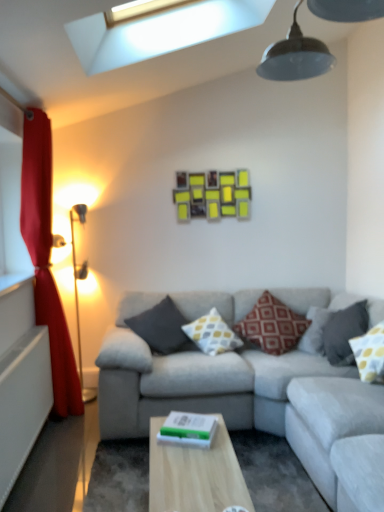
Question: From a real-world perspective, is dark gray fabric pillow at center, which is counted as the 5th pillow, starting from the right, under light wood table at center?

Choices:
 (A) no
 (B) yes

Answer: (A)

Question: Does dark gray fabric pillow at center, which is counted as the 5th pillow, starting from the right, turn towards light wood table at center?

Choices:
 (A) no
 (B) yes

Answer: (B)

Question: Is dark gray fabric pillow at center, which is counted as the 5th pillow, starting from the right, in front of light wood table at center?

Choices:
 (A) yes
 (B) no

Answer: (B)

Question: Considering the relative sizes of dark gray fabric pillow at center, which is counted as the 5th pillow, starting from the right, and light wood table at center in the image provided, is dark gray fabric pillow at center, which is counted as the 5th pillow, starting from the right, bigger than light wood table at center?

Choices:
 (A) no
 (B) yes

Answer: (A)

Question: Is dark gray fabric pillow at center, which is counted as the 5th pillow, starting from the right, shorter than light wood table at center?

Choices:
 (A) no
 (B) yes

Answer: (A)

Question: Considering the relative positions of dark gray fabric pillow at center, marked as the 1th pillow in a left-to-right arrangement, and light wood table at center in the image provided, is dark gray fabric pillow at center, marked as the 1th pillow in a left-to-right arrangement, to the right of light wood table at center from the viewer's perspective?

Choices:
 (A) no
 (B) yes

Answer: (A)

Question: From the image's perspective, does light wood table at center appear higher than yellow dotted fabric pillow at right, marked as the fifth pillow in a left-to-right arrangement?

Choices:
 (A) no
 (B) yes

Answer: (A)

Question: Does light wood table at center have a smaller size compared to yellow dotted fabric pillow at right, the first pillow in the right-to-left sequence?

Choices:
 (A) yes
 (B) no

Answer: (B)

Question: From a real-world perspective, does light wood table at center sit lower than yellow dotted fabric pillow at right, marked as the fifth pillow in a left-to-right arrangement?

Choices:
 (A) no
 (B) yes

Answer: (B)

Question: Considering the relative sizes of light wood table at center and yellow dotted fabric pillow at right, marked as the fifth pillow in a left-to-right arrangement, in the image provided, is light wood table at center wider than yellow dotted fabric pillow at right, marked as the fifth pillow in a left-to-right arrangement,?

Choices:
 (A) yes
 (B) no

Answer: (A)

Question: Can you confirm if light wood table at center is thinner than yellow dotted fabric pillow at right, marked as the fifth pillow in a left-to-right arrangement?

Choices:
 (A) yes
 (B) no

Answer: (B)

Question: Considering the relative sizes of light wood table at center and yellow dotted fabric pillow at right, marked as the fifth pillow in a left-to-right arrangement, in the image provided, is light wood table at center bigger than yellow dotted fabric pillow at right, marked as the fifth pillow in a left-to-right arrangement,?

Choices:
 (A) no
 (B) yes

Answer: (B)

Question: From the image's perspective, is dark gray fabric pillow at right, acting as the 2th pillow starting from the right, on yellow matte picture frame at upper center?

Choices:
 (A) yes
 (B) no

Answer: (B)